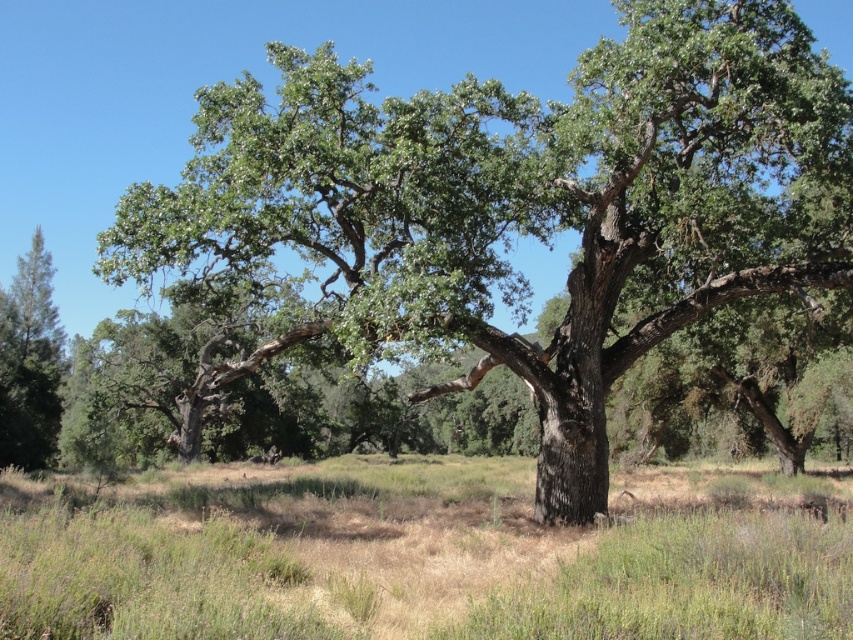
Which of these two, green rough bark tree at center or green grass at center, stands shorter?

green grass at center is shorter.

Is point (670, 268) behind point (369, 560)?

That is True.

Which is in front, point (709, 234) or point (689, 588)?

Positioned in front is point (689, 588).

Where is `green rough bark tree at center`? The width and height of the screenshot is (853, 640). green rough bark tree at center is located at coordinates (525, 204).